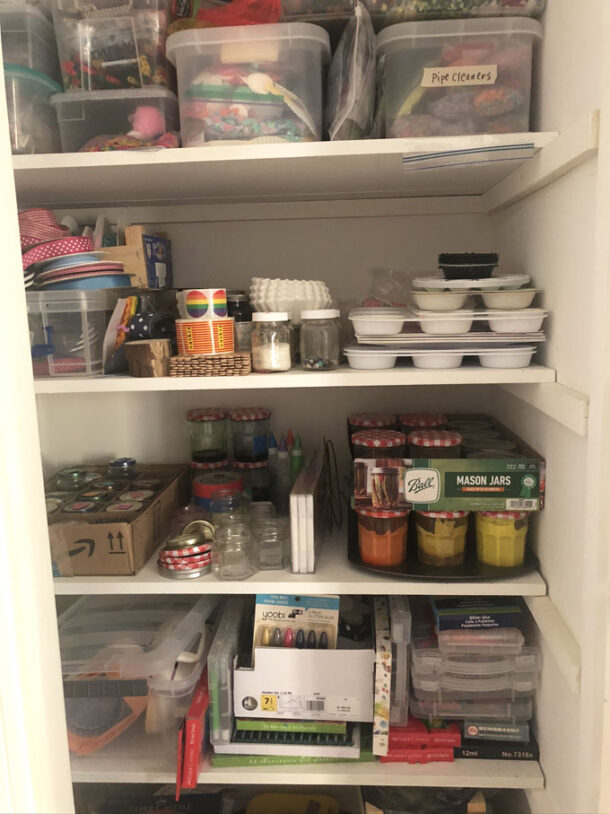
The image size is (610, 814). I want to click on coffee filters, so click(296, 292).